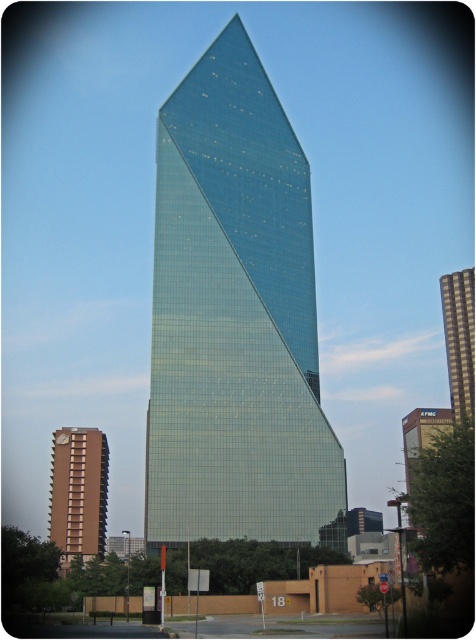
What do you see at coordinates (79, 493) in the screenshot?
I see `brown concrete building at lower left` at bounding box center [79, 493].

Between brown concrete building at lower left and glassy teal skyscraper at right, which one has more height?

Standing taller between the two is glassy teal skyscraper at right.

What do you see at coordinates (79, 493) in the screenshot?
I see `brown concrete building at lower left` at bounding box center [79, 493].

At what (x,y) coordinates should I click in order to perform the action: click on brown concrete building at lower left. Please return your answer as a coordinate pair (x, y). Looking at the image, I should click on (79, 493).

Who is positioned more to the left, glassy teal skyscraper at right or green glass skyscraper at center?

green glass skyscraper at center is more to the left.

Who is shorter, glassy teal skyscraper at right or green glass skyscraper at center?

glassy teal skyscraper at right is shorter.

The height and width of the screenshot is (640, 476). What are the coordinates of `glassy teal skyscraper at right` in the screenshot? It's located at (459, 339).

You are a GUI agent. You are given a task and a screenshot of the screen. Output one action in this format:
    pyautogui.click(x=<x>, y=<y>)
    Task: Click on the glassy teal skyscraper at right
    The image size is (476, 640).
    Given the screenshot: What is the action you would take?
    pyautogui.click(x=459, y=339)

Between point (58, 436) and point (403, 424), which one is positioned in front?

Point (58, 436)

Image resolution: width=476 pixels, height=640 pixels. What do you see at coordinates (79, 493) in the screenshot?
I see `brown concrete building at lower left` at bounding box center [79, 493].

The image size is (476, 640). What do you see at coordinates (79, 493) in the screenshot?
I see `brown concrete building at lower left` at bounding box center [79, 493].

Locate an element on the screen. Image resolution: width=476 pixels, height=640 pixels. brown concrete building at lower left is located at coordinates (79, 493).